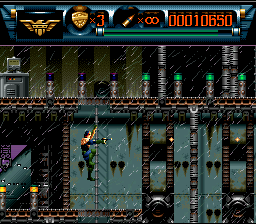
Image resolution: width=256 pixels, height=224 pixels. I want to click on yellow light, so click(32, 189), click(3, 189).